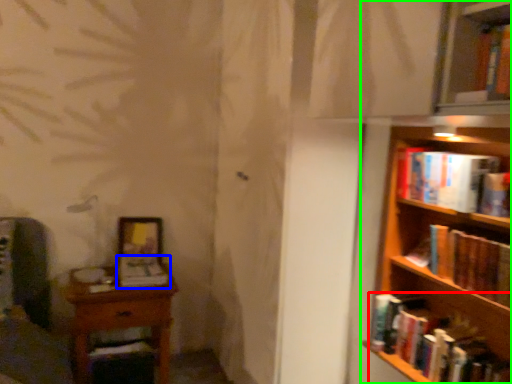
Question: Which object is positioned closest to book (highlighted by a red box)? Select from book (highlighted by a blue box) and bookcase (highlighted by a green box).

Choices:
 (A) book
 (B) bookcase

Answer: (B)